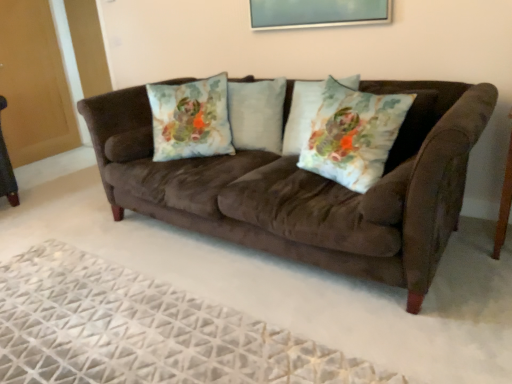
Question: Considering the positions of white textured rug at lower center and fluffy white pillow at center, which appears as the first pillow when viewed from the left, in the image, is white textured rug at lower center bigger or smaller than fluffy white pillow at center, which appears as the first pillow when viewed from the left,?

Choices:
 (A) small
 (B) big

Answer: (B)

Question: Visually, is white textured rug at lower center positioned to the left or to the right of fluffy white pillow at center, arranged as the 2th pillow when viewed from the right?

Choices:
 (A) right
 (B) left

Answer: (B)

Question: Estimate the real-world distances between objects in this image. Which object is farther from the metallic silver picture frame at upper center?

Choices:
 (A) fluffy white pillow at center, which appears as the first pillow when viewed from the left
 (B) light blue fabric pillow at center, which is the first pillow in right-to-left order
 (C) floral fabric pillow at center, positioned as the 1th throw pillow in front-to-back order
 (D) white textured rug at lower center
 (E) suede couch at center

Answer: (D)

Question: Which is farther from the metallic silver picture frame at upper center?

Choices:
 (A) brown wood side table at right
 (B) floral fabric pillow at center, positioned as the second throw pillow in front-to-back order
 (C) fluffy white pillow at center, which appears as the first pillow when viewed from the left
 (D) floral fabric pillow at center, positioned as the 1th throw pillow in front-to-back order
 (E) suede couch at center

Answer: (A)